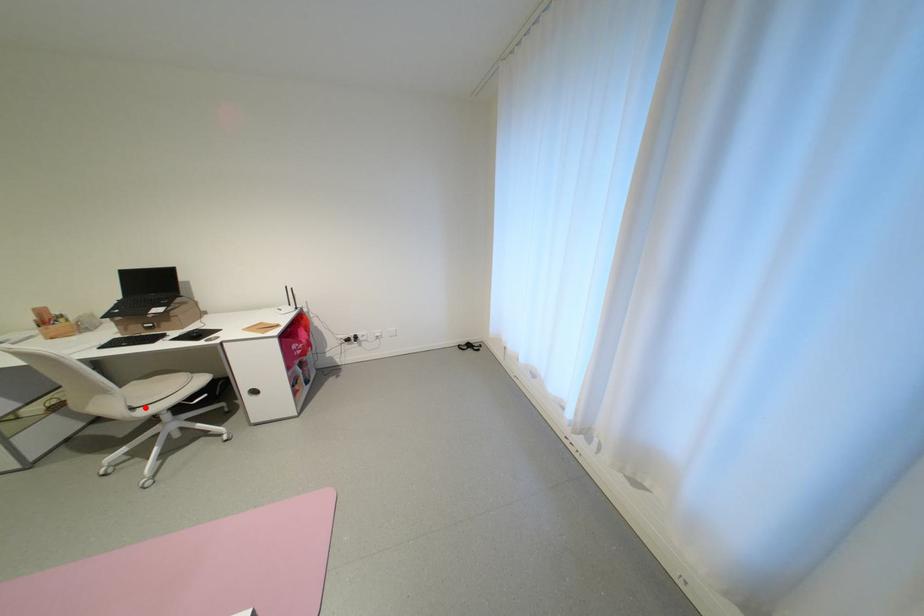
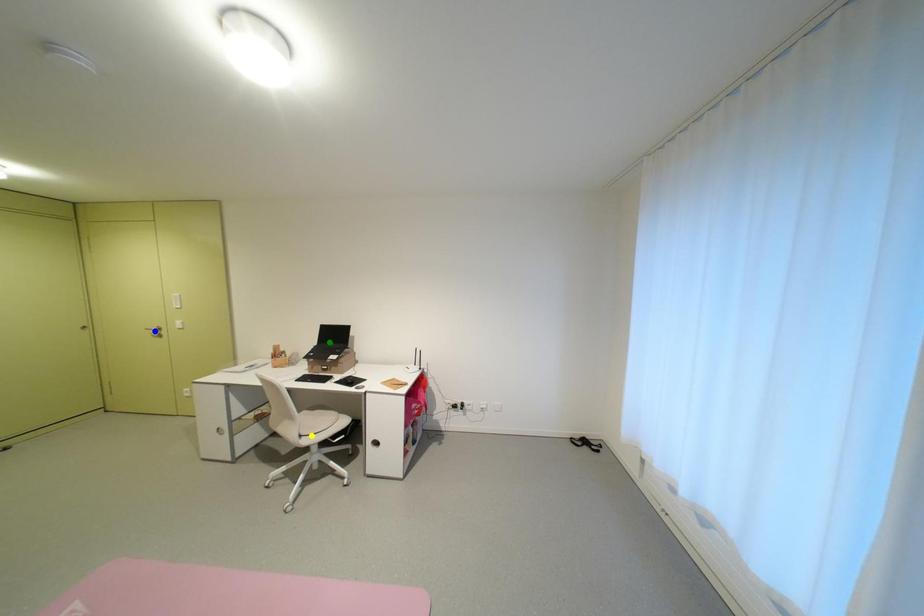
Question: I am providing you with two images of the same scene from different viewpoints. A red point is marked on the first image. You are given multiple points on the second image. Which point in image 2 represents the same 3d spot as the red point in image 1?

Choices:
 (A) green point
 (B) yellow point
 (C) blue point

Answer: (B)